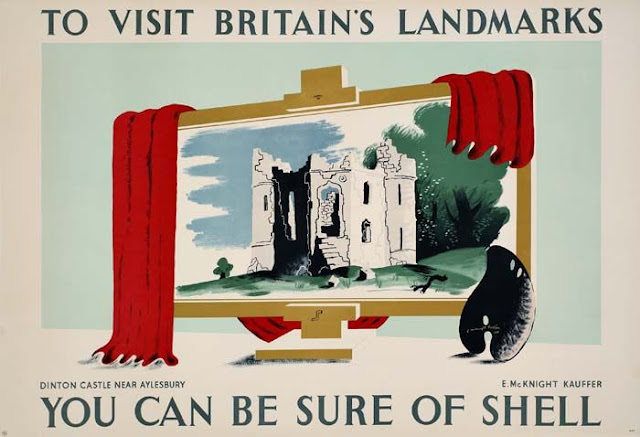
In order to click on plant in this screenshot , I will do `click(221, 264)`.